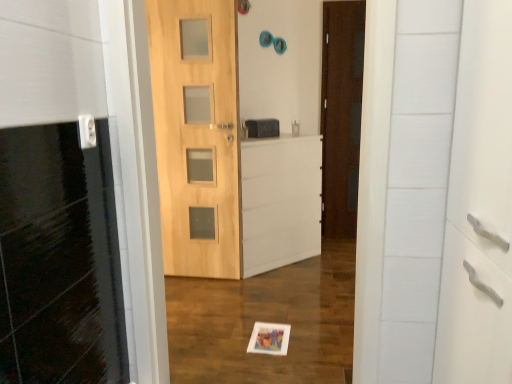
Question: Would you say white matte file cabinet at center is inside or outside matte black medicine cabinet at center?

Choices:
 (A) outside
 (B) inside

Answer: (A)

Question: Is point (291, 190) positioned closer to the camera than point (269, 120)?

Choices:
 (A) closer
 (B) farther

Answer: (B)

Question: Which is farther from the natural wood door at center, the 2th door from the back?

Choices:
 (A) matte black medicine cabinet at center
 (B) dark brown wood door at center, arranged as the 2th door when viewed from the left
 (C) white matte file cabinet at center
 (D) white plastic electric outlet at upper left

Answer: (D)

Question: Estimate the real-world distances between objects in this image. Which object is farther from the matte black medicine cabinet at center?

Choices:
 (A) white matte file cabinet at center
 (B) white plastic electric outlet at upper left
 (C) natural wood door at center, marked as the 2th door in a right-to-left arrangement
 (D) dark brown wood door at center, which ranks as the first door in back-to-front order

Answer: (B)